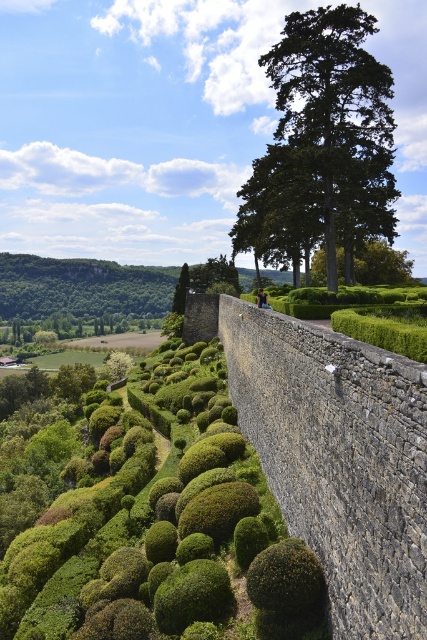
Is point (321, 141) farther from camera compared to point (380, 266)?

No, (321, 141) is closer to viewer.

Image resolution: width=427 pixels, height=640 pixels. What do you see at coordinates (324, 138) in the screenshot?
I see `green textured tree at upper center` at bounding box center [324, 138].

At what (x,y) coordinates should I click in order to perform the action: click on green textured tree at upper center. Please return your answer as a coordinate pair (x, y). This screenshot has height=640, width=427. Looking at the image, I should click on (324, 138).

Locate an element on the screen. This screenshot has width=427, height=640. green textured tree at upper center is located at coordinates 324,138.

Does green leafy tree at center appear over green leafy tree at upper center?

Incorrect, green leafy tree at center is not positioned above green leafy tree at upper center.

From the picture: Between green leafy tree at center and green leafy tree at upper center, which one is positioned higher?

green leafy tree at upper center is above.

At what (x,y) coordinates should I click in order to perform the action: click on green leafy tree at center. Please return your answer as a coordinate pair (x, y). This screenshot has width=427, height=640. Looking at the image, I should click on (380, 262).

Does green textured tree at upper center have a greater height compared to green leafy tree at upper center?

Yes.

Who is more distant from viewer, (328,76) or (183,280)?

The point (183,280) is more distant.

This screenshot has height=640, width=427. Find the location of `green textured tree at upper center`. green textured tree at upper center is located at coordinates (324, 138).